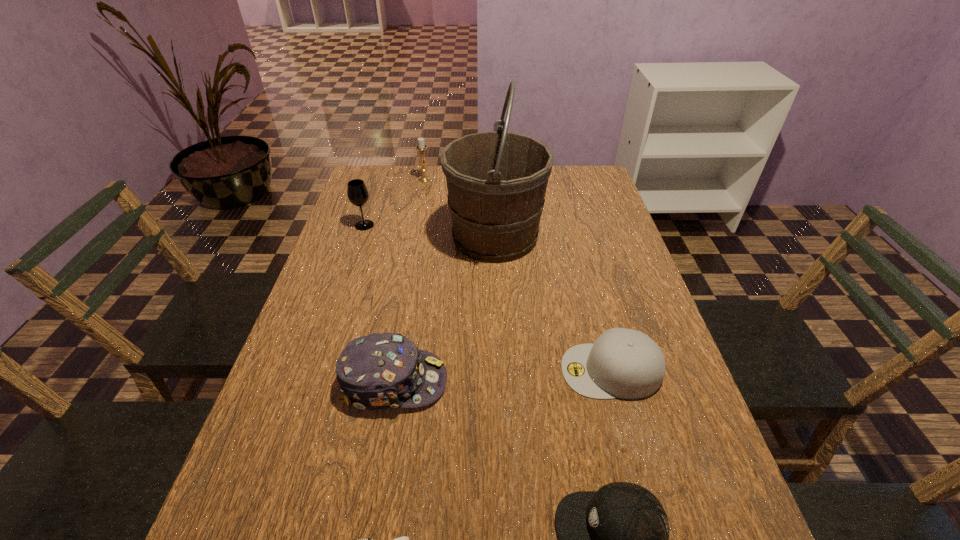
Identify the location of the second closest object relative to the wineglass. (421, 147).

Select which cap is the second closest to the shortest object. Please provide its 2D coordinates. Your answer should be formatted as a tuple, i.e. [(x, y)], where the tuple contains the x and y coordinates of a point satisfying the conditions above.

[(616, 539)]

The image size is (960, 540). What are the coordinates of `the second closest cap to the candle holder` in the screenshot? It's located at (625, 363).

The image size is (960, 540). I want to click on vacant space that satisfies the following two spatial constraints: 1. on the back side of the wineglass; 2. on the right side of the candle holder, so click(x=379, y=179).